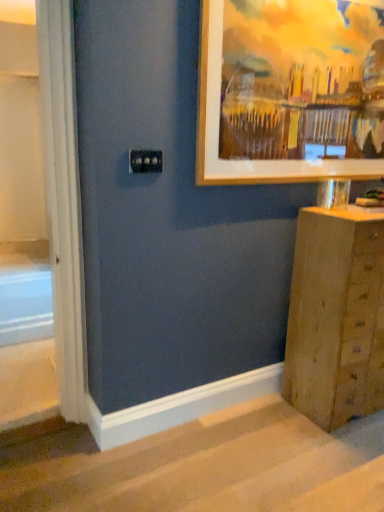
Question: Is carpeted stairs at lower center wider or thinner than wooden chest of drawers at lower right?

Choices:
 (A) thin
 (B) wide

Answer: (B)

Question: Is carpeted stairs at lower center in front of or behind wooden chest of drawers at lower right in the image?

Choices:
 (A) front
 (B) behind

Answer: (A)

Question: Estimate the real-world distances between objects in this image. Which object is closer to the wooden frame at upper right?

Choices:
 (A) carpeted stairs at lower center
 (B) wooden chest of drawers at lower right

Answer: (B)

Question: Which of these objects is positioned farthest from the wooden chest of drawers at lower right?

Choices:
 (A) wooden frame at upper right
 (B) carpeted stairs at lower center

Answer: (A)